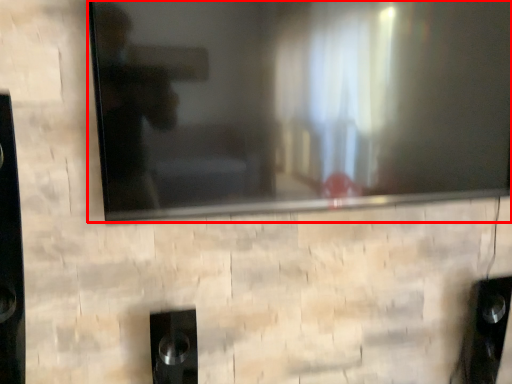
Question: Where is television (annotated by the red box) located in relation to speaker in the image?

Choices:
 (A) left
 (B) right

Answer: (B)